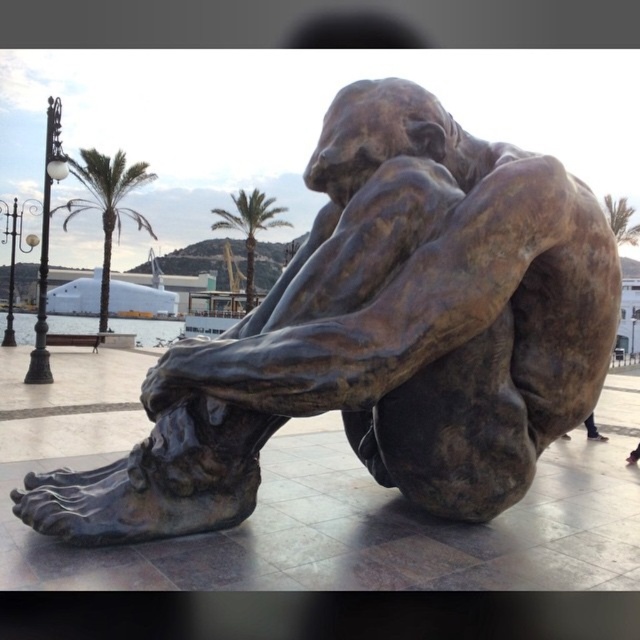
Question: From the image, what is the correct spatial relationship of bronze statue at center in relation to green leafy palm tree at upper right?

Choices:
 (A) left
 (B) right

Answer: (A)

Question: Estimate the real-world distances between objects in this image. Which object is farther from the bronze statue at center?

Choices:
 (A) green leafy palm tree at center
 (B) green leafy palm tree at upper right

Answer: (A)

Question: Which of the following is the farthest from the observer?

Choices:
 (A) (637, 225)
 (B) (88, 172)
 (C) (413, 284)

Answer: (A)

Question: Among these points, which one is nearest to the camera?

Choices:
 (A) (280, 284)
 (B) (77, 177)

Answer: (A)

Question: Is the position of bronze statue at center less distant than that of green leafy palm tree at center?

Choices:
 (A) yes
 (B) no

Answer: (A)

Question: Does green leafy palm tree at upper left lie in front of green leafy palm tree at center?

Choices:
 (A) no
 (B) yes

Answer: (B)